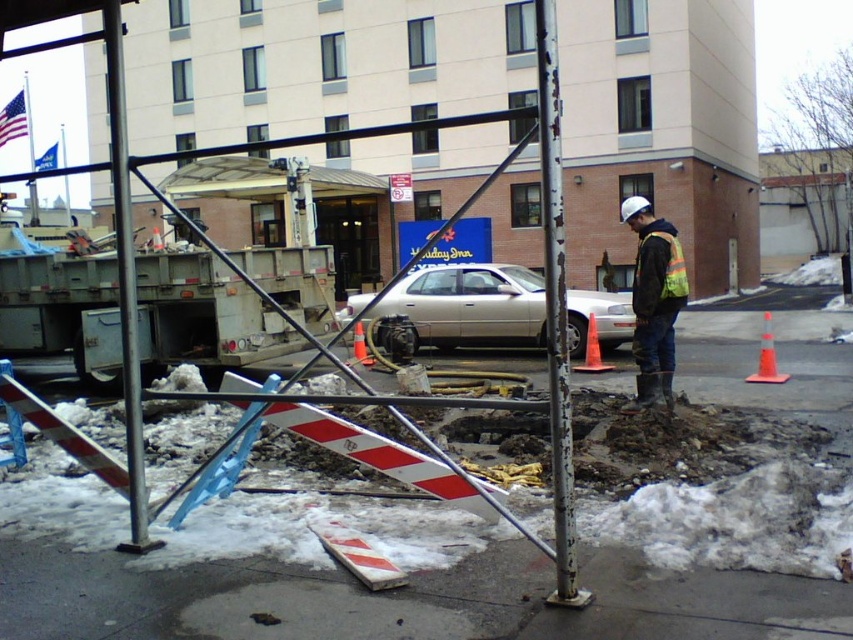
From the picture: You are a delivery driver who needs to park your silver metallic sedan at center in a spot that requires a minimum clearance of 15 feet. Based on the scene, can you safely park there?

The silver metallic sedan at center is 12.51 feet from the camera, which is less than the required 15 feet clearance. Therefore, it is not safe to park there.